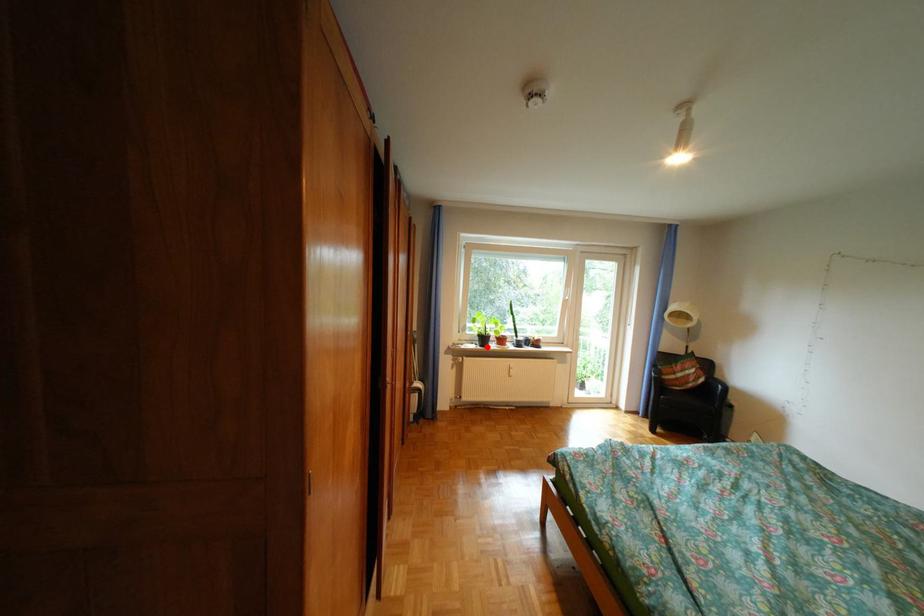
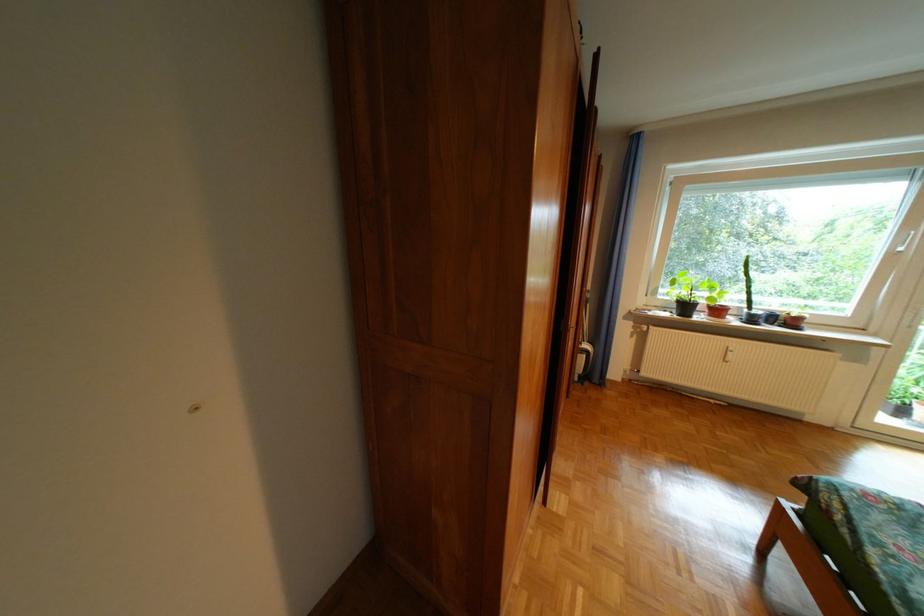
Locate, in the second image, the point that corresponds to the highlighted location in the first image.

(679, 315)